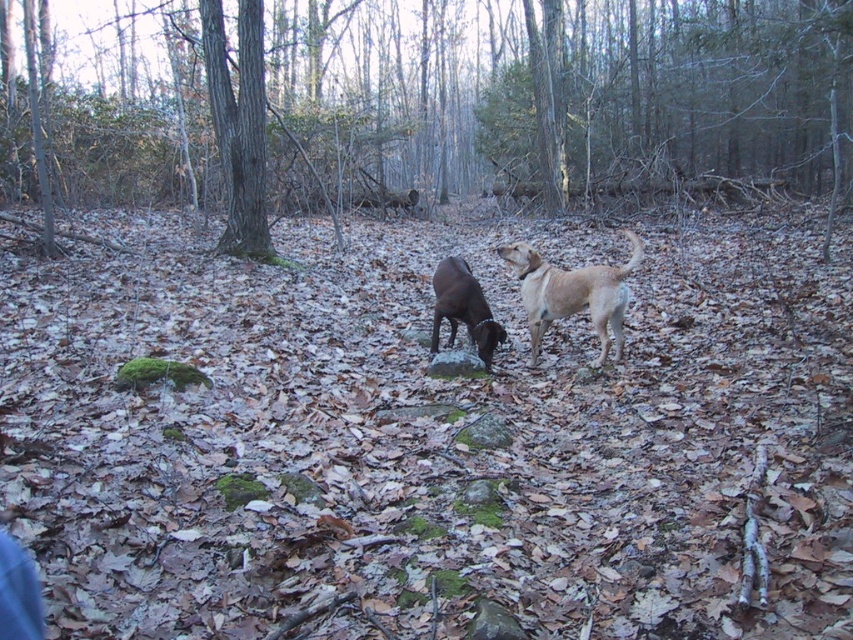
Question: Estimate the real-world distances between objects in this image. Which object is closer to the brown rough bark tree at center?

Choices:
 (A) light brown fur at center
 (B) shiny black dog at center

Answer: (B)

Question: Does smooth bark tree at center have a greater width compared to light brown fur at center?

Choices:
 (A) no
 (B) yes

Answer: (B)

Question: Is light brown fur at center below shiny black dog at center?

Choices:
 (A) no
 (B) yes

Answer: (A)

Question: Which object appears closest to the camera in this image?

Choices:
 (A) brown rough bark tree at center
 (B) shiny black dog at center
 (C) smooth bark tree at center

Answer: (B)

Question: Is brown rough bark tree at center to the left of light brown fur at center from the viewer's perspective?

Choices:
 (A) yes
 (B) no

Answer: (A)

Question: Considering the real-world distances, which object is closest to the shiny black dog at center?

Choices:
 (A) light brown fur at center
 (B) smooth bark tree at center
 (C) brown rough bark tree at center

Answer: (A)